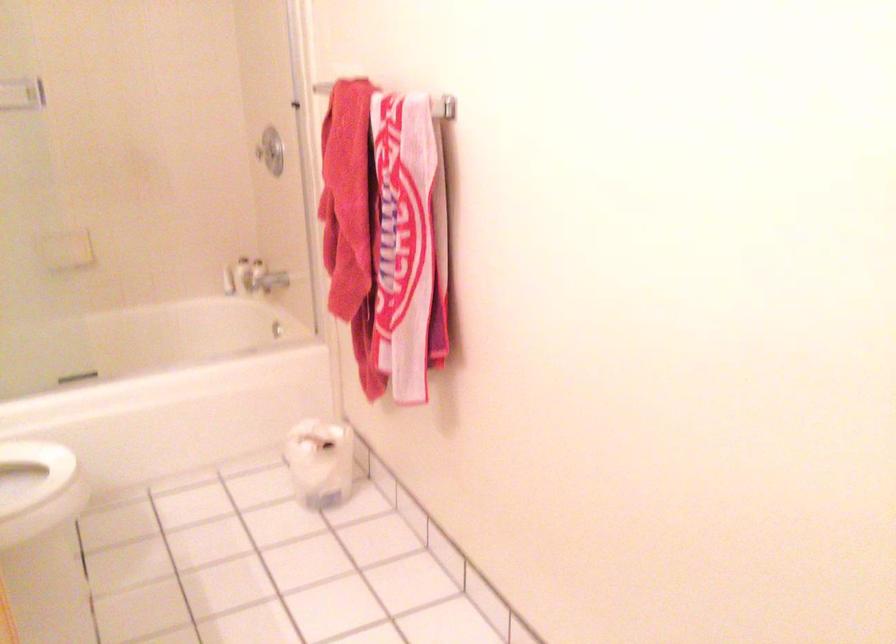
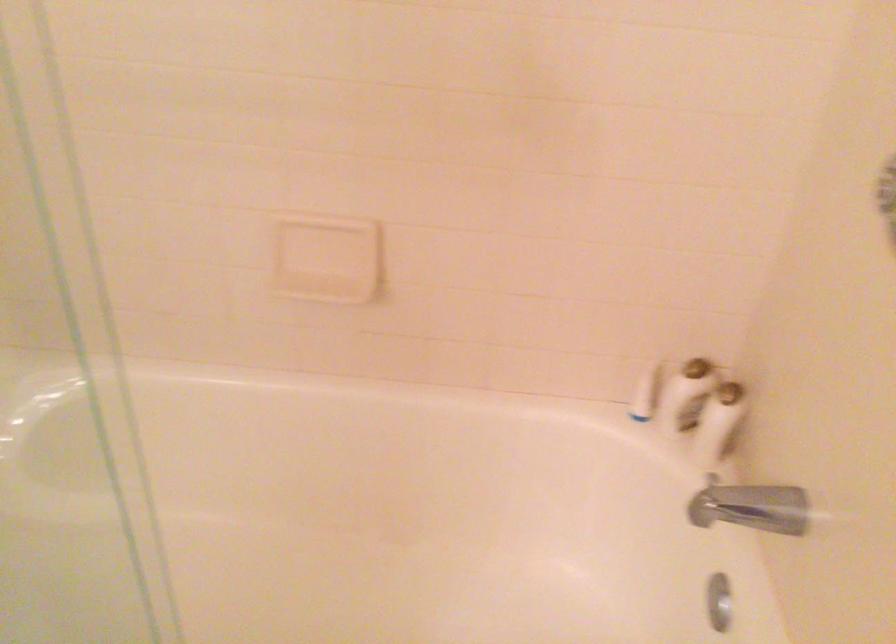
The point at (277, 325) is marked in the first image. Where is the corresponding point in the second image?

(719, 601)